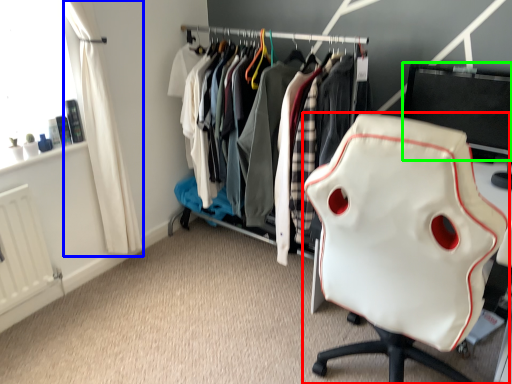
Question: Considering the real-world distances, which object is farthest from chair (highlighted by a red box)? curtain (highlighted by a blue box) or desktop (highlighted by a green box)?

Choices:
 (A) curtain
 (B) desktop

Answer: (A)